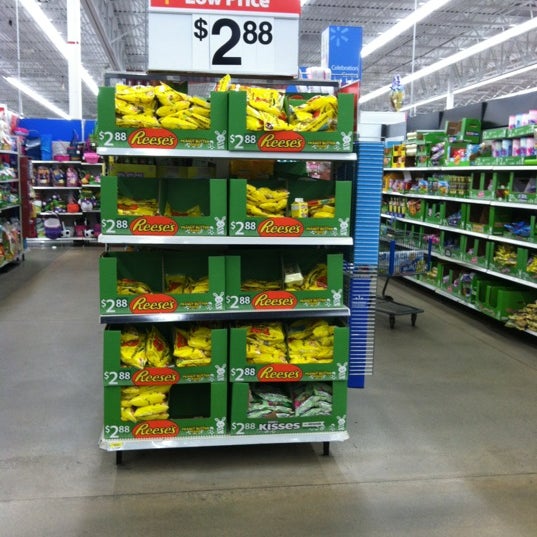
This screenshot has width=537, height=537. I want to click on gray ceiling, so click(127, 28).